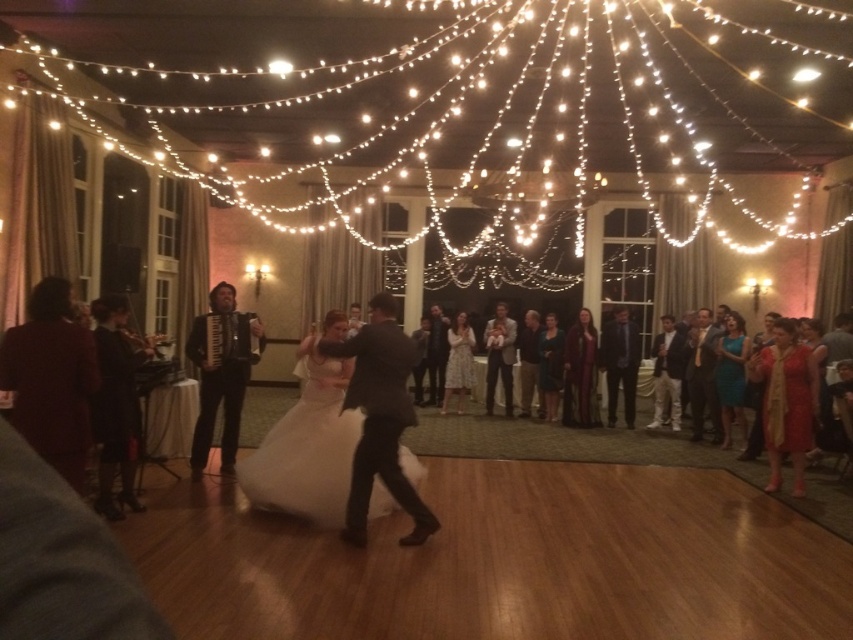
Measure the distance from white satin dress at center to black leather accordion at center.

white satin dress at center is 3.52 feet from black leather accordion at center.

Does white satin dress at center have a larger size compared to black leather accordion at center?

Yes, white satin dress at center is bigger than black leather accordion at center.

Locate an element on the screen. white satin dress at center is located at coordinates (309, 438).

Find the location of a particular element. white satin dress at center is located at coordinates (309, 438).

Is point (412, 461) farther from camera compared to point (460, 397)?

That is False.

Is point (299, 504) closer to viewer compared to point (457, 368)?

That is True.

At what (x,y) coordinates should I click in order to perform the action: click on white satin dress at center. Please return your answer as a coordinate pair (x, y). Looking at the image, I should click on (309, 438).

Looking at this image, which is more to the right, black leather accordion at center or white floral dress at center?

From the viewer's perspective, white floral dress at center appears more on the right side.

Can you confirm if black leather accordion at center is positioned to the right of white floral dress at center?

In fact, black leather accordion at center is to the left of white floral dress at center.

What do you see at coordinates (221, 376) in the screenshot?
I see `black leather accordion at center` at bounding box center [221, 376].

Find the location of a particular element. The height and width of the screenshot is (640, 853). black leather accordion at center is located at coordinates (221, 376).